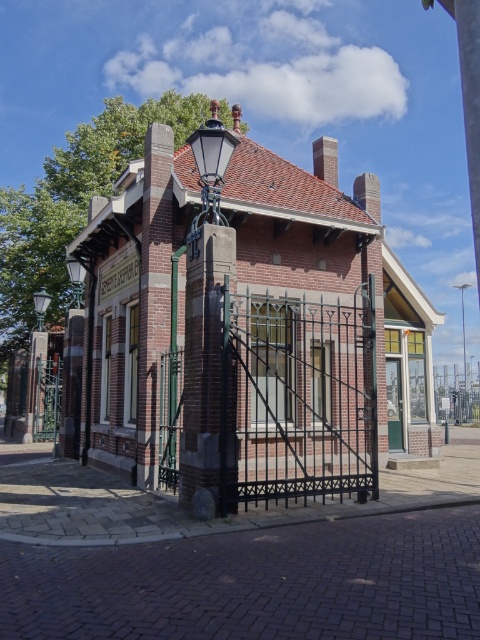
Between point (222, 440) and point (237, 140), which one is positioned in front?

Point (222, 440) is in front.

Does brick pillar at center appear on the left side of matte black lamp post at upper center?

Incorrect, brick pillar at center is not on the left side of matte black lamp post at upper center.

Who is more distant from viewer, (196, 467) or (207, 147)?

The point (207, 147) is behind.

Find the location of `brick pillar at center`. brick pillar at center is located at coordinates (207, 374).

Is brick pillar at center to the left of metallic silver streetlamp at center from the viewer's perspective?

Indeed, brick pillar at center is positioned on the left side of metallic silver streetlamp at center.

Which is in front, point (231, 284) or point (463, 285)?

Point (231, 284)

The width and height of the screenshot is (480, 640). In order to click on brick pillar at center in this screenshot , I will do `click(207, 374)`.

In the scene shown: Who is lower down, matte black lamp at left or metallic silver streetlamp at center?

metallic silver streetlamp at center

Can you confirm if matte black lamp at left is thinner than metallic silver streetlamp at center?

Indeed, matte black lamp at left has a lesser width compared to metallic silver streetlamp at center.

Where is `matte black lamp at left`? The width and height of the screenshot is (480, 640). matte black lamp at left is located at coordinates (75, 276).

Where is `matte black lamp at left`? This screenshot has width=480, height=640. matte black lamp at left is located at coordinates (75, 276).